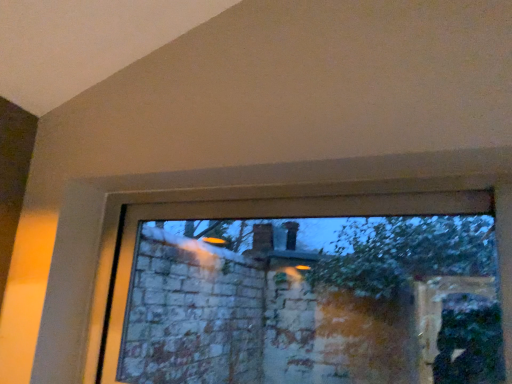
This screenshot has height=384, width=512. Describe the element at coordinates (308, 292) in the screenshot. I see `matte glass window at center` at that location.

You are a GUI agent. You are given a task and a screenshot of the screen. Output one action in this format:
    pyautogui.click(x=<x>, y=<y>)
    Task: Click on the matte glass window at center
    This screenshot has width=512, height=384.
    Given the screenshot: What is the action you would take?
    pyautogui.click(x=308, y=292)

In the scene shown: What is the approximate width of matte glass window at center?

6.16 centimeters.

The height and width of the screenshot is (384, 512). Find the location of `matte glass window at center`. matte glass window at center is located at coordinates (308, 292).